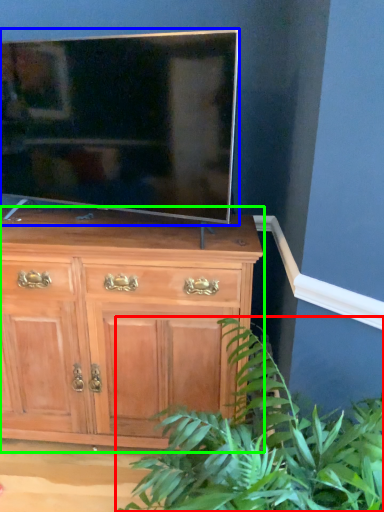
Question: Based on their relative distances, which object is nearer to houseplant (highlighted by a red box)? Choose from television (highlighted by a blue box) and chest of drawers (highlighted by a green box).

Choices:
 (A) television
 (B) chest of drawers

Answer: (B)